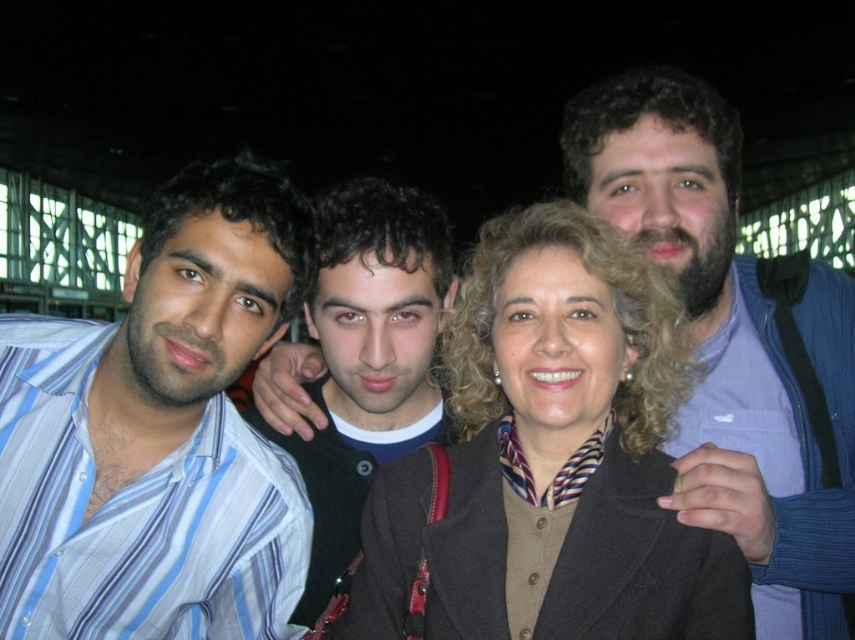
You are standing in front of the group of four people in the photo. You want to know which of the two points, point (594, 259) or point (304, 612), is closer to you. Can you determine this based on their positions?

Point (594, 259) is closer to the viewer than point (304, 612).

You are a photographer trying to adjust the spacing between the dark brown woolen coat at center and the striped cotton shirt at left for a better composition. Based on their widths, which object requires more space to accommodate its width?

The dark brown woolen coat at center requires more space because its width surpasses that of the striped cotton shirt at left.

You are a photographer trying to adjust the lighting for a group photo. You notice the striped cotton shirt at left and the dark brown hair at center. Which object is positioned more to the left side of the image?

The striped cotton shirt at left is positioned more to the left side of the image than the dark brown hair at center.